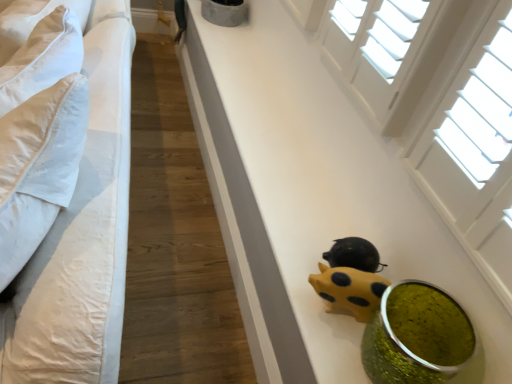
Question: Is white cotton bed at left positioned far away from green glittery vase at lower right?

Choices:
 (A) no
 (B) yes

Answer: (A)

Question: From the image's perspective, is white cotton bed at left under green glittery vase at lower right?

Choices:
 (A) yes
 (B) no

Answer: (B)

Question: From a real-world perspective, is white cotton bed at left located beneath green glittery vase at lower right?

Choices:
 (A) yes
 (B) no

Answer: (A)

Question: Could you tell me if white cotton bed at left is turned towards green glittery vase at lower right?

Choices:
 (A) no
 (B) yes

Answer: (A)

Question: Is green glittery vase at lower right completely or partially inside white cotton bed at left?

Choices:
 (A) yes
 (B) no

Answer: (B)

Question: Would you say yellow matte piggy bank at lower center is inside or outside yellow matte piggy bank at lower center?

Choices:
 (A) inside
 (B) outside

Answer: (B)

Question: In the image, is yellow matte piggy bank at lower center on the left side or the right side of yellow matte piggy bank at lower center?

Choices:
 (A) right
 (B) left

Answer: (A)

Question: Relative to yellow matte piggy bank at lower center, is yellow matte piggy bank at lower center in front or behind?

Choices:
 (A) front
 (B) behind

Answer: (B)

Question: Is point (355, 271) closer or farther from the camera than point (347, 334)?

Choices:
 (A) farther
 (B) closer

Answer: (B)

Question: Is point (359, 304) closer or farther from the camera than point (87, 62)?

Choices:
 (A) closer
 (B) farther

Answer: (A)

Question: Based on their sizes in the image, would you say yellow matte piggy bank at lower center is bigger or smaller than white cotton bed at left?

Choices:
 (A) small
 (B) big

Answer: (A)

Question: From the image's perspective, is yellow matte piggy bank at lower center above or below white cotton bed at left?

Choices:
 (A) above
 (B) below

Answer: (B)

Question: Choose the correct answer: Is yellow matte piggy bank at lower center inside white cotton bed at left or outside it?

Choices:
 (A) inside
 (B) outside

Answer: (B)

Question: From their relative heights in the image, would you say yellow matte piggy bank at lower center is taller or shorter than green glittery vase at lower right?

Choices:
 (A) short
 (B) tall

Answer: (A)

Question: Does point [x=342, y=266] appear closer or farther from the camera than point [x=385, y=370]?

Choices:
 (A) farther
 (B) closer

Answer: (A)